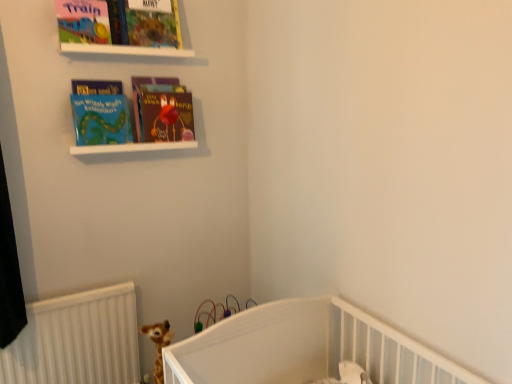
Measure the distance between point (177, 24) and camera.

They are 6.29 feet apart.

Image resolution: width=512 pixels, height=384 pixels. Describe the element at coordinates (152, 23) in the screenshot. I see `matte colorful book at upper center, marked as the second book cover in a left-to-right arrangement` at that location.

How much space does matte hardcover book at center, which is the second book in left-to-right order, occupy vertically?

It is 30.66 centimeters.

At what (x,y) coordinates should I click in order to perform the action: click on matte hardcover book at center, which is the second book in left-to-right order. Please return your answer as a coordinate pair (x, y). Looking at the image, I should click on (162, 110).

The image size is (512, 384). Describe the element at coordinates (132, 147) in the screenshot. I see `white matte shelf at upper center` at that location.

At what (x,y) coordinates should I click in order to perform the action: click on matte colorful book at upper center, marked as the second book cover in a left-to-right arrangement. Please return your answer as a coordinate pair (x, y). The image size is (512, 384). Looking at the image, I should click on (152, 23).

Consider the image. Is matte colorful book at upper center, which is counted as the 1th book cover, starting from the right, positioned with its back to matte hardcover book at center, acting as the first book starting from the right?

No, matte colorful book at upper center, which is counted as the 1th book cover, starting from the right,'s orientation is not away from matte hardcover book at center, acting as the first book starting from the right.

Between matte colorful book at upper center, marked as the second book cover in a left-to-right arrangement, and matte hardcover book at center, which is the second book in left-to-right order, which one has less height?

matte colorful book at upper center, marked as the second book cover in a left-to-right arrangement.

Does matte colorful book at upper center, marked as the second book cover in a left-to-right arrangement, appear on the right side of matte hardcover book at center, which is the second book in left-to-right order?

In fact, matte colorful book at upper center, marked as the second book cover in a left-to-right arrangement, is to the left of matte hardcover book at center, which is the second book in left-to-right order.

Which object is closer to the camera, matte colorful book at upper center, which is counted as the 1th book cover, starting from the right, or matte hardcover book at center, which is the second book in left-to-right order?

Positioned in front is matte colorful book at upper center, which is counted as the 1th book cover, starting from the right.

Which point is more forward, (84, 152) or (60, 36)?

Point (60, 36)

Is white matte shelf at upper center looking in the opposite direction of matte board book at upper left, the 2th book cover in the right-to-left sequence?

No, matte board book at upper left, the 2th book cover in the right-to-left sequence, is not at the back of white matte shelf at upper center.

Where is `book cover in front of the white matte shelf at upper center`? The image size is (512, 384). book cover in front of the white matte shelf at upper center is located at coordinates (83, 21).

Could you tell me if matte blue book at upper left, which appears as the 2th book when viewed from the right, is facing matte colorful book at upper center, which is counted as the 1th book cover, starting from the right?

No, matte blue book at upper left, which appears as the 2th book when viewed from the right, does not turn towards matte colorful book at upper center, which is counted as the 1th book cover, starting from the right.

Who is taller, matte blue book at upper left, which appears as the first book when viewed from the left, or matte colorful book at upper center, marked as the second book cover in a left-to-right arrangement?

Standing taller between the two is matte blue book at upper left, which appears as the first book when viewed from the left.

Which point is more distant from viewer, [102,122] or [169,6]?

The point [169,6] is farther.

From a real-world perspective, is matte blue book at upper left, which appears as the 2th book when viewed from the right, on top of matte colorful book at upper center, which is counted as the 1th book cover, starting from the right?

Actually, matte blue book at upper left, which appears as the 2th book when viewed from the right, is physically below matte colorful book at upper center, which is counted as the 1th book cover, starting from the right, in the real world.

Considering the positions of objects matte hardcover book at center, which is the second book in left-to-right order, and matte board book at upper left, the 2th book cover in the right-to-left sequence, in the image provided, who is behind, matte hardcover book at center, which is the second book in left-to-right order, or matte board book at upper left, the 2th book cover in the right-to-left sequence,?

matte hardcover book at center, which is the second book in left-to-right order, is more distant.

Would you say matte board book at upper left, the 2th book cover in the right-to-left sequence, is part of matte hardcover book at center, acting as the first book starting from the right,'s contents?

No, matte board book at upper left, the 2th book cover in the right-to-left sequence, is not inside matte hardcover book at center, acting as the first book starting from the right.

Is matte hardcover book at center, which is the second book in left-to-right order, oriented away from matte board book at upper left, marked as the 1th book cover in a left-to-right arrangement?

No, matte board book at upper left, marked as the 1th book cover in a left-to-right arrangement, is not at the back of matte hardcover book at center, which is the second book in left-to-right order.

How many degrees apart are the facing directions of white matte shelf at upper center and matte hardcover book at center, which is the second book in left-to-right order?

The facing directions of white matte shelf at upper center and matte hardcover book at center, which is the second book in left-to-right order, are 0.00308 degrees apart.

Which of these two, white matte shelf at upper center or matte hardcover book at center, which is the second book in left-to-right order, stands taller?

matte hardcover book at center, which is the second book in left-to-right order, is taller.

From the image's perspective, would you say white matte shelf at upper center is shown under matte hardcover book at center, which is the second book in left-to-right order?

Indeed, from the image's perspective, white matte shelf at upper center is shown beneath matte hardcover book at center, which is the second book in left-to-right order.

Is white matte shelf at upper center facing towards matte hardcover book at center, which is the second book in left-to-right order?

No, white matte shelf at upper center is not facing towards matte hardcover book at center, which is the second book in left-to-right order.

Which object is thinner, matte colorful book at upper center, which is counted as the 1th book cover, starting from the right, or matte blue book at upper left, which appears as the 2th book when viewed from the right?

matte blue book at upper left, which appears as the 2th book when viewed from the right, is thinner.

Is matte colorful book at upper center, which is counted as the 1th book cover, starting from the right, next to matte blue book at upper left, which appears as the 2th book when viewed from the right, and touching it?

They are not placed beside each other.

In the scene shown: Considering the positions of objects matte colorful book at upper center, marked as the second book cover in a left-to-right arrangement, and matte blue book at upper left, which appears as the first book when viewed from the left, in the image provided, who is more to the left, matte colorful book at upper center, marked as the second book cover in a left-to-right arrangement, or matte blue book at upper left, which appears as the first book when viewed from the left,?

From the viewer's perspective, matte blue book at upper left, which appears as the first book when viewed from the left, appears more on the left side.

From the image's perspective, does matte colorful book at upper center, which is counted as the 1th book cover, starting from the right, appear higher than matte blue book at upper left, which appears as the first book when viewed from the left?

Yes, from the image's perspective, matte colorful book at upper center, which is counted as the 1th book cover, starting from the right, is on top of matte blue book at upper left, which appears as the first book when viewed from the left.

Consider the image. From the image's perspective, is matte board book at upper left, the 2th book cover in the right-to-left sequence, located beneath matte hardcover book at center, acting as the first book starting from the right?

No.

Does matte board book at upper left, marked as the 1th book cover in a left-to-right arrangement, turn towards matte hardcover book at center, which is the second book in left-to-right order?

No, matte board book at upper left, marked as the 1th book cover in a left-to-right arrangement, is not oriented towards matte hardcover book at center, which is the second book in left-to-right order.

Considering the positions of objects matte board book at upper left, marked as the 1th book cover in a left-to-right arrangement, and matte hardcover book at center, which is the second book in left-to-right order, in the image provided, who is behind, matte board book at upper left, marked as the 1th book cover in a left-to-right arrangement, or matte hardcover book at center, which is the second book in left-to-right order,?

matte hardcover book at center, which is the second book in left-to-right order, is further from the camera.

This screenshot has width=512, height=384. I want to click on book that appears on the right of matte colorful book at upper center, which is counted as the 1th book cover, starting from the right, so click(162, 110).

Where is `book cover in front of the white matte shelf at upper center`? This screenshot has width=512, height=384. book cover in front of the white matte shelf at upper center is located at coordinates (83, 21).

From the image, which object appears to be nearer to matte hardcover book at center, which is the second book in left-to-right order, matte blue book at upper left, which appears as the 2th book when viewed from the right, or white matte shelf at upper center?

The object closer to matte hardcover book at center, which is the second book in left-to-right order, is white matte shelf at upper center.

Looking at this image, considering their positions, is white matte shelf at upper center positioned closer to matte board book at upper left, the 2th book cover in the right-to-left sequence, than matte blue book at upper left, which appears as the first book when viewed from the left?

The object closer to matte board book at upper left, the 2th book cover in the right-to-left sequence, is matte blue book at upper left, which appears as the first book when viewed from the left.

Looking at this image, which object lies nearer to the anchor point matte board book at upper left, the 2th book cover in the right-to-left sequence, matte colorful book at upper center, marked as the second book cover in a left-to-right arrangement, or white matte shelf at upper center?

matte colorful book at upper center, marked as the second book cover in a left-to-right arrangement, is positioned closer to the anchor matte board book at upper left, the 2th book cover in the right-to-left sequence.

Looking at the image, which one is located closer to matte colorful book at upper center, marked as the second book cover in a left-to-right arrangement, matte hardcover book at center, acting as the first book starting from the right, or matte board book at upper left, marked as the 1th book cover in a left-to-right arrangement?

Based on the image, matte board book at upper left, marked as the 1th book cover in a left-to-right arrangement, appears to be nearer to matte colorful book at upper center, marked as the second book cover in a left-to-right arrangement.

Considering their positions, is white matte shelf at upper center positioned further to matte hardcover book at center, acting as the first book starting from the right, than matte colorful book at upper center, marked as the second book cover in a left-to-right arrangement?

Among the two, matte colorful book at upper center, marked as the second book cover in a left-to-right arrangement, is located further to matte hardcover book at center, acting as the first book starting from the right.

Considering their positions, is white matte shelf at upper center positioned further to matte blue book at upper left, which appears as the first book when viewed from the left, than matte colorful book at upper center, which is counted as the 1th book cover, starting from the right?

matte colorful book at upper center, which is counted as the 1th book cover, starting from the right, is positioned further to the anchor matte blue book at upper left, which appears as the first book when viewed from the left.

Based on their spatial positions, is matte board book at upper left, the 2th book cover in the right-to-left sequence, or matte blue book at upper left, which appears as the 2th book when viewed from the right, closer to matte hardcover book at center, which is the second book in left-to-right order?

Among the two, matte blue book at upper left, which appears as the 2th book when viewed from the right, is located nearer to matte hardcover book at center, which is the second book in left-to-right order.

Considering their positions, is matte hardcover book at center, which is the second book in left-to-right order, positioned closer to matte board book at upper left, marked as the 1th book cover in a left-to-right arrangement, than matte blue book at upper left, which appears as the first book when viewed from the left?

The object closer to matte board book at upper left, marked as the 1th book cover in a left-to-right arrangement, is matte blue book at upper left, which appears as the first book when viewed from the left.

Find the location of a particular element. The image size is (512, 384). book between matte colorful book at upper center, marked as the second book cover in a left-to-right arrangement, and matte blue book at upper left, which appears as the first book when viewed from the left, from top to bottom is located at coordinates (162, 110).

Locate an element on the screen. This screenshot has width=512, height=384. book between matte board book at upper left, marked as the 1th book cover in a left-to-right arrangement, and matte blue book at upper left, which appears as the 2th book when viewed from the right, from top to bottom is located at coordinates (162, 110).

I want to click on book cover that lies between matte colorful book at upper center, which is counted as the 1th book cover, starting from the right, and white matte shelf at upper center from top to bottom, so pyautogui.click(x=83, y=21).

You are a GUI agent. You are given a task and a screenshot of the screen. Output one action in this format:
    pyautogui.click(x=<x>, y=<y>)
    Task: Click on the book cover between matte colorful book at upper center, marked as the second book cover in a left-to-right arrangement, and matte blue book at upper left, which appears as the first book when viewed from the left, from top to bottom
    The image size is (512, 384).
    Given the screenshot: What is the action you would take?
    pyautogui.click(x=83, y=21)